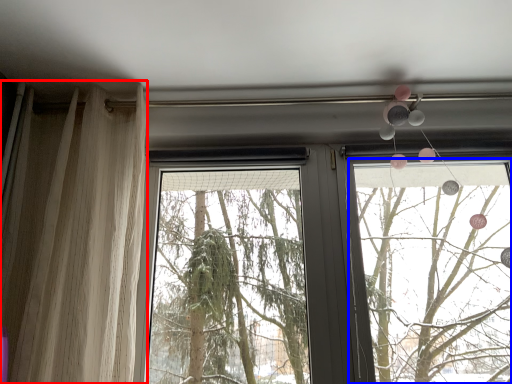
Question: Which object is further to the camera taking this photo, curtain (highlighted by a red box) or window frame (highlighted by a blue box)?

Choices:
 (A) curtain
 (B) window frame

Answer: (B)